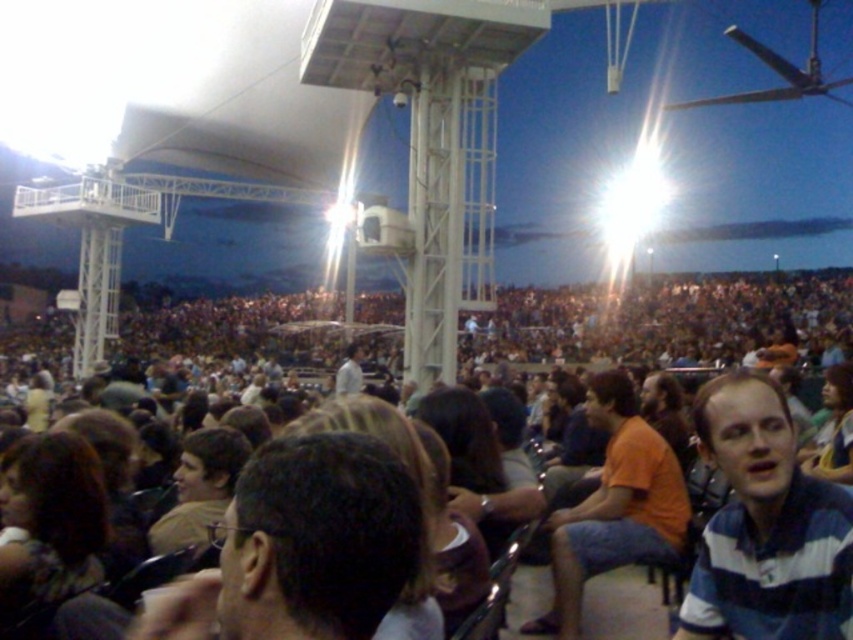
Question: Is dark brown hair at center to the left of light brown hair at center from the viewer's perspective?

Choices:
 (A) yes
 (B) no

Answer: (B)

Question: Based on their relative distances, which object is farther from the white matte shirt at center?

Choices:
 (A) striped cotton shirt at lower right
 (B) dark brown hair at center
 (C) light brown hair at center

Answer: (A)

Question: Based on their relative distances, which object is farther from the white matte shirt at center?

Choices:
 (A) dark brown hair at lower left
 (B) striped cotton shirt at lower right
 (C) light brown hair at center
 (D) orange cotton shirt at center

Answer: (B)

Question: Estimate the real-world distances between objects in this image. Which object is farther from the dark brown hair at center?

Choices:
 (A) orange cotton shirt at center
 (B) dark brown hair at lower left

Answer: (A)

Question: In this image, where is dark brown hair at center located relative to orange cotton shirt at center?

Choices:
 (A) right
 (B) left

Answer: (B)

Question: Is dark brown hair at lower left behind white matte shirt at center?

Choices:
 (A) yes
 (B) no

Answer: (B)